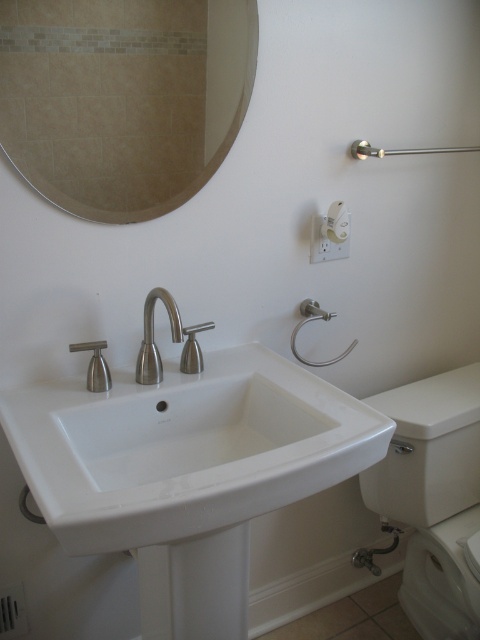
Question: Is the position of white glossy toilet bowl at lower right less distant than that of brushed metal faucet at center?

Choices:
 (A) no
 (B) yes

Answer: (A)

Question: Which of the following is the farthest from the observer?

Choices:
 (A) white ceramic sink at center
 (B) brushed metal faucet at center
 (C) beige tile mirror at upper left

Answer: (B)

Question: Which of the following is the closest to the observer?

Choices:
 (A) (428, 484)
 (B) (151, 156)
 (C) (203, 506)
 (D) (180, 326)

Answer: (C)

Question: Is beige tile mirror at upper left closer to the viewer compared to white glossy toilet bowl at lower right?

Choices:
 (A) yes
 (B) no

Answer: (A)

Question: Estimate the real-world distances between objects in this image. Which object is closer to the white ceramic sink at center?

Choices:
 (A) white glossy toilet bowl at lower right
 (B) brushed metal faucet at center

Answer: (B)

Question: Can you confirm if white ceramic sink at center is positioned above brushed metal faucet at center?

Choices:
 (A) no
 (B) yes

Answer: (A)